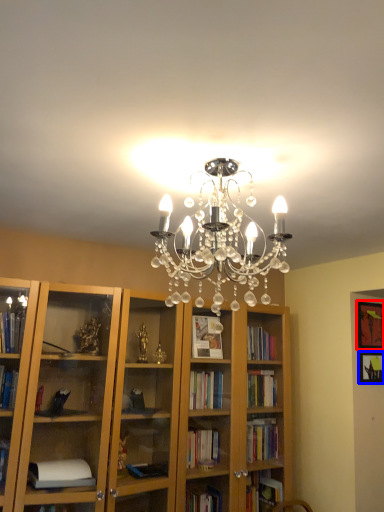
Question: Which object appears closest to the camera in this image, picture frame (highlighted by a red box) or picture frame (highlighted by a blue box)?

Choices:
 (A) picture frame
 (B) picture frame

Answer: (B)